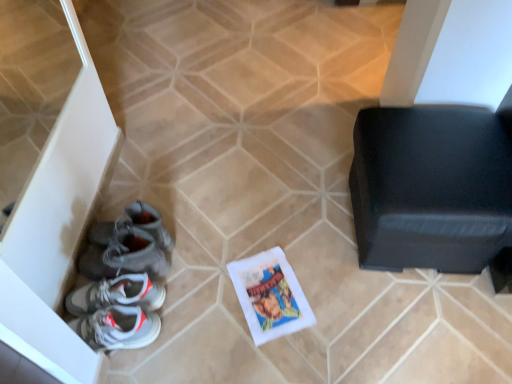
Where is `free space in front of black leather ottoman at right`? The width and height of the screenshot is (512, 384). free space in front of black leather ottoman at right is located at coordinates (411, 330).